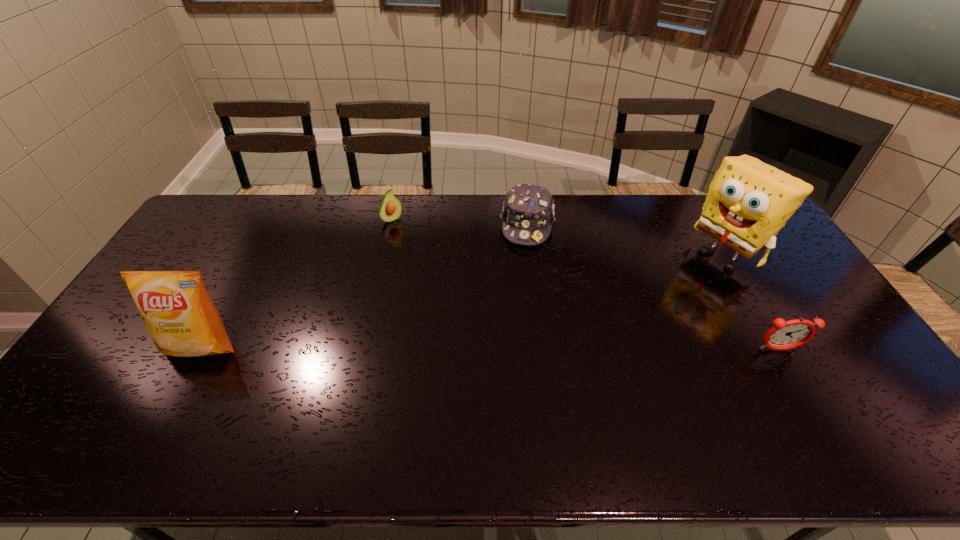
Image resolution: width=960 pixels, height=540 pixels. Identify the location of free space between the leftmost object and the fourth object from right to left. (297, 284).

Where is `free spot between the alarm clock and the avocado`? The width and height of the screenshot is (960, 540). free spot between the alarm clock and the avocado is located at coordinates coord(585,285).

The image size is (960, 540). Identify the location of empty space that is in between the alarm clock and the sponge. (752, 302).

I want to click on free space between the third object from left to right and the crisp (potato chip), so click(365, 285).

Identify the location of vacant space that is in between the third object from right to left and the tallest object. The width and height of the screenshot is (960, 540). (626, 239).

Where is `free point between the alarm clock and the fourth object from right to left`? free point between the alarm clock and the fourth object from right to left is located at coordinates (585, 285).

At what (x,y) coordinates should I click in order to perform the action: click on free spot between the headwear and the fourth shortest object. Please return your answer as a coordinate pair (x, y). This screenshot has width=960, height=540. Looking at the image, I should click on (365, 285).

Locate an element on the screen. This screenshot has width=960, height=540. object that is the closest one to the third object from left to right is located at coordinates (390, 208).

Select which object appears as the third closest to the second object from left to right. Please provide its 2D coordinates. Your answer should be formatted as a tuple, i.e. [(x, y)], where the tuple contains the x and y coordinates of a point satisfying the conditions above.

[(748, 202)]